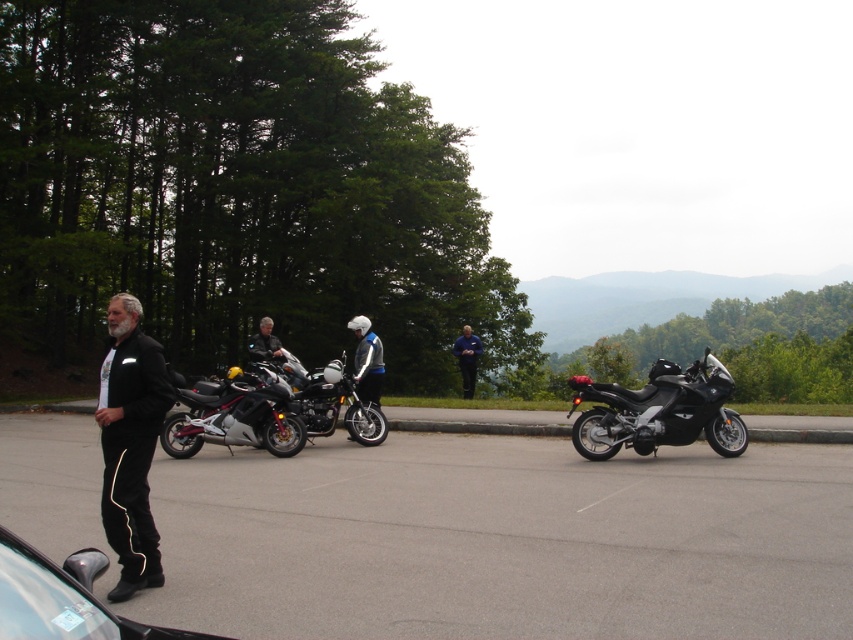
Question: Which object is closer to the camera taking this photo?

Choices:
 (A) gray asphalt parking lot at center
 (B) black glossy car at lower left

Answer: (B)

Question: Is the position of shiny silver motorcycle at center less distant than that of silver metallic helmet at center?

Choices:
 (A) yes
 (B) no

Answer: (A)

Question: Is the position of gray asphalt parking lot at center less distant than that of shiny silver motorcycle at center?

Choices:
 (A) no
 (B) yes

Answer: (B)

Question: Can you confirm if black matte jacket at left is positioned to the left of black matte/synthetic motorcycle at right?

Choices:
 (A) yes
 (B) no

Answer: (A)

Question: Which object is the closest to the gray asphalt parking lot at center?

Choices:
 (A) black matte/synthetic motorcycle at right
 (B) shiny silver motorcycle at center
 (C) black matte jacket at left

Answer: (A)

Question: Which object is farther from the camera taking this photo?

Choices:
 (A) black matte/synthetic motorcycle at right
 (B) gray asphalt parking lot at center
 (C) silver metallic helmet at center
 (D) black matte jacket at left

Answer: (C)